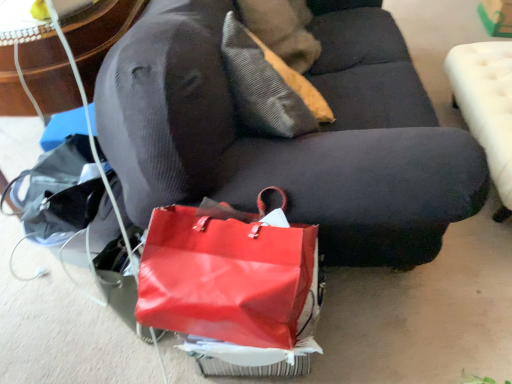
Question: Looking at their shapes, would you say shiny red handbag at lower center is wider or thinner than white tufted ottoman at right?

Choices:
 (A) wide
 (B) thin

Answer: (B)

Question: From the image's perspective, is shiny red handbag at lower center located above or below white tufted ottoman at right?

Choices:
 (A) below
 (B) above

Answer: (A)

Question: Which of these objects is positioned closest to the textured beige pillow at upper center?

Choices:
 (A) shiny red handbag at lower center
 (B) velvet dark gray couch at center
 (C) white tufted ottoman at right

Answer: (B)

Question: Considering the real-world distances, which object is closest to the white tufted ottoman at right?

Choices:
 (A) shiny red handbag at lower center
 (B) velvet dark gray couch at center
 (C) textured beige pillow at upper center

Answer: (B)